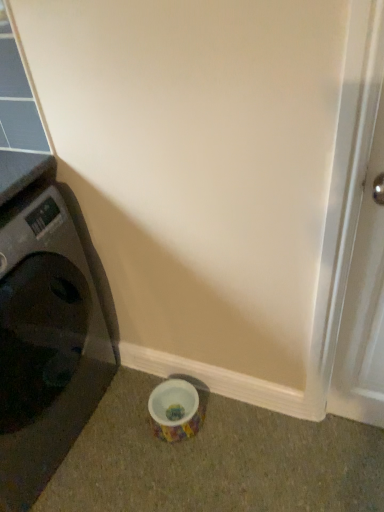
Question: Is white glossy screen door at right facing towards black plastic washing machine at left?

Choices:
 (A) no
 (B) yes

Answer: (A)

Question: From a real-world perspective, is white glossy screen door at right physically above black plastic washing machine at left?

Choices:
 (A) yes
 (B) no

Answer: (A)

Question: Can you confirm if white glossy screen door at right is bigger than black plastic washing machine at left?

Choices:
 (A) no
 (B) yes

Answer: (A)

Question: Can you confirm if white glossy screen door at right is positioned to the left of black plastic washing machine at left?

Choices:
 (A) yes
 (B) no

Answer: (B)

Question: Is white glossy screen door at right in front of black plastic washing machine at left?

Choices:
 (A) yes
 (B) no

Answer: (A)

Question: From the image's perspective, is white glossy screen door at right beneath black plastic washing machine at left?

Choices:
 (A) yes
 (B) no

Answer: (B)

Question: Is black plastic washing machine at left oriented away from white glossy screen door at right?

Choices:
 (A) yes
 (B) no

Answer: (B)

Question: Can you confirm if black plastic washing machine at left is shorter than white glossy screen door at right?

Choices:
 (A) no
 (B) yes

Answer: (B)

Question: From a real-world perspective, is black plastic washing machine at left physically below white glossy screen door at right?

Choices:
 (A) no
 (B) yes

Answer: (B)

Question: Is black plastic washing machine at left not near white glossy screen door at right?

Choices:
 (A) yes
 (B) no

Answer: (B)

Question: Is the depth of black plastic washing machine at left greater than that of white glossy screen door at right?

Choices:
 (A) yes
 (B) no

Answer: (A)

Question: Is black plastic washing machine at left to the right of white glossy screen door at right from the viewer's perspective?

Choices:
 (A) yes
 (B) no

Answer: (B)

Question: Is white glossy screen door at right to the left or to the right of black plastic washing machine at left in the image?

Choices:
 (A) right
 (B) left

Answer: (A)